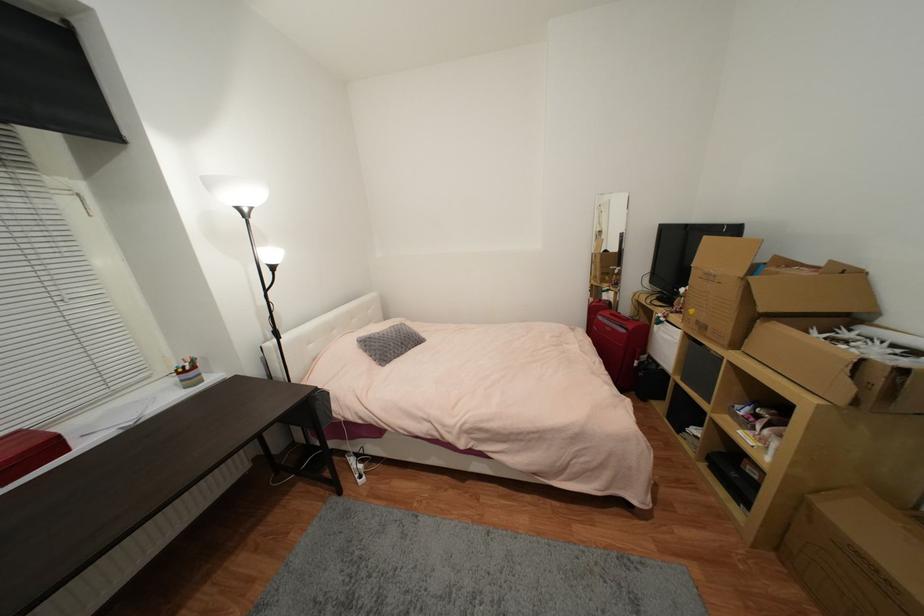
You are a GUI agent. You are given a task and a screenshot of the screen. Output one action in this format:
    pyautogui.click(x=<x>, y=<y>)
    Task: Click on the white storage bin
    This screenshot has height=616, width=924.
    Given the screenshot: What is the action you would take?
    pyautogui.click(x=663, y=344)